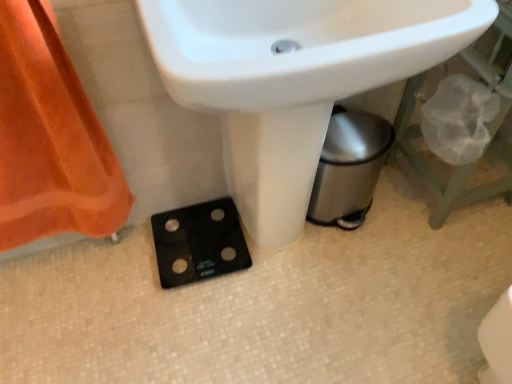
Where is `vacant area that is in front of white glossy sink at center`? vacant area that is in front of white glossy sink at center is located at coordinates (288, 346).